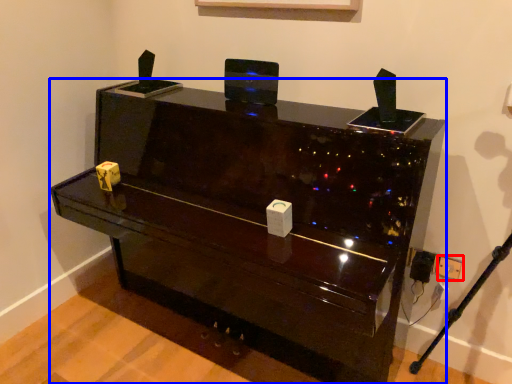
Question: Which object appears closest to the camera in this image, electric outlet (highlighted by a red box) or furniture (highlighted by a blue box)?

Choices:
 (A) electric outlet
 (B) furniture

Answer: (B)